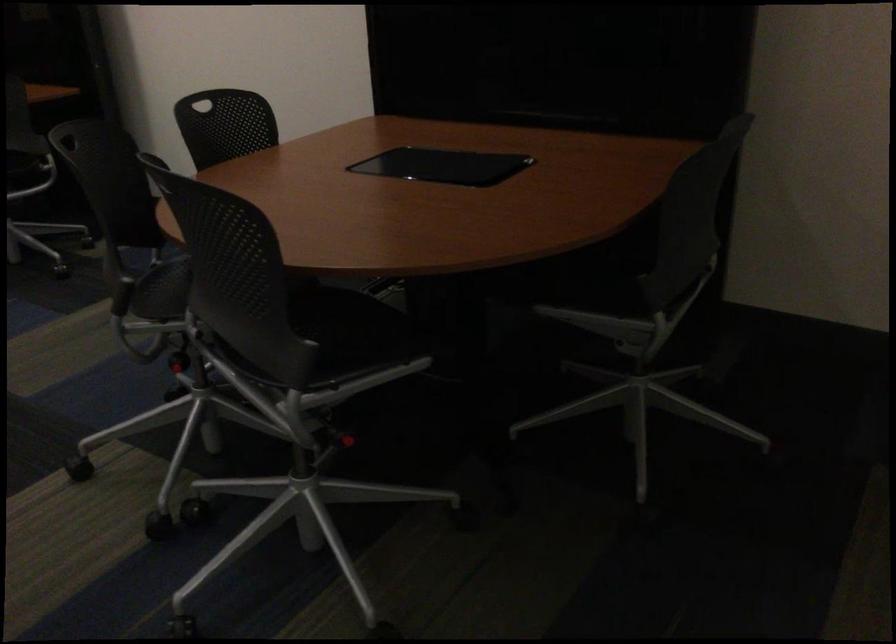
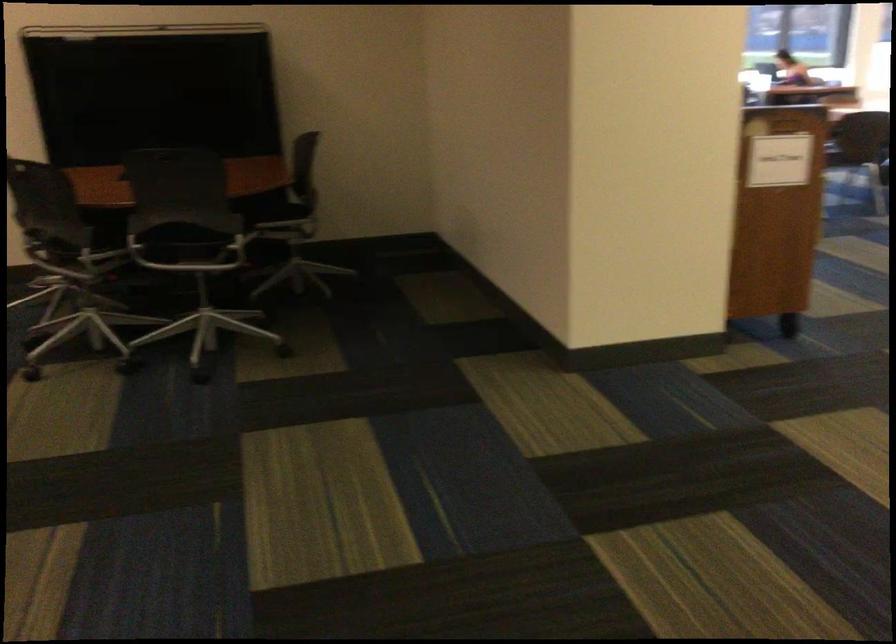
Question: I am providing you with two images of the same scene from different viewpoints. After the viewpoint changes to image2, which objects are now occluded?

Choices:
 (A) red mop press handle
 (B) chair backrest handle
 (C) black chair sitting surface
 (D) metal chair armrest

Answer: (B)